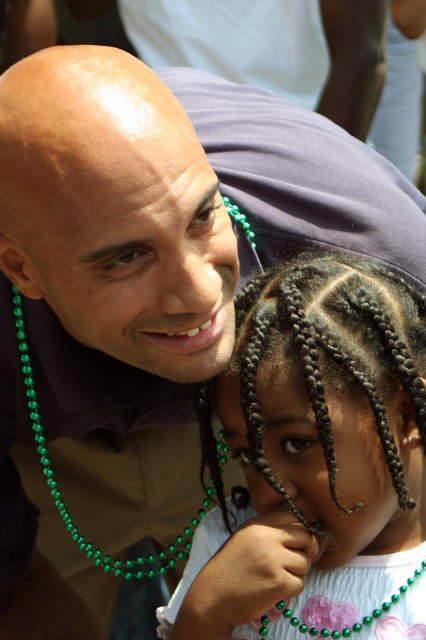
Who is taller, dark brown braided hair at center or green pearl necklace at lower center?

dark brown braided hair at center

Between point (373, 611) and point (340, 632), which one is positioned behind?

Positioned behind is point (373, 611).

Between point (270, 480) and point (331, 636), which one is positioned in front?

Point (270, 480) is more forward.

Locate an element on the screen. The width and height of the screenshot is (426, 640). dark brown braided hair at center is located at coordinates (316, 465).

Does dark brown braided hair at center have a smaller size compared to green beaded necklace at left?

Correct, dark brown braided hair at center occupies less space than green beaded necklace at left.

Which is below, dark brown braided hair at center or green beaded necklace at left?

green beaded necklace at left is below.

Locate an element on the screen. dark brown braided hair at center is located at coordinates (316, 465).

Image resolution: width=426 pixels, height=640 pixels. Find the location of `dark brown braided hair at center`. dark brown braided hair at center is located at coordinates (316, 465).

Between point (54, 492) and point (371, 616), which one is positioned in front?

Point (371, 616) is in front.

Between point (117, 573) and point (313, 634), which one is positioned in front?

Positioned in front is point (313, 634).

Identify the location of green beaded necklace at left. (62, 493).